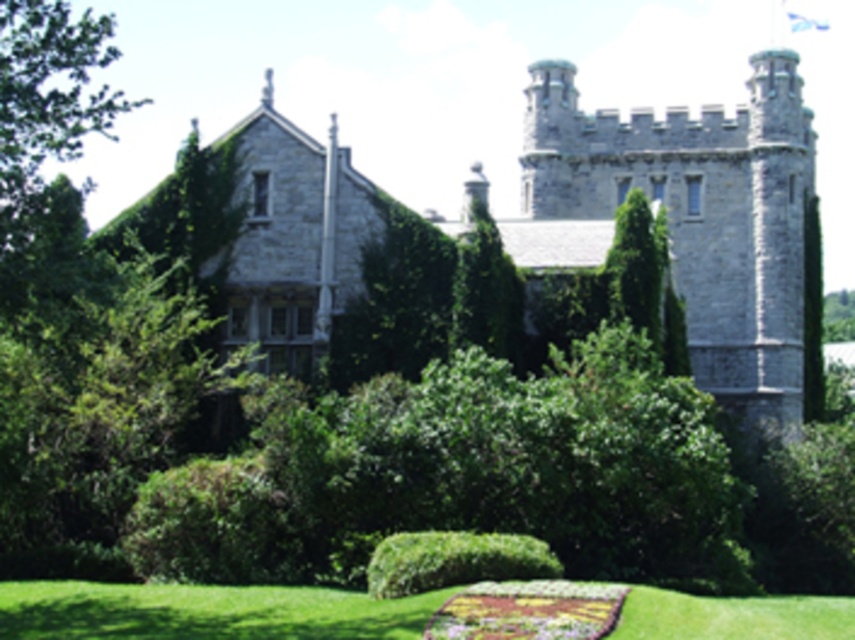
Who is shorter, green grass at lower center or multicolored fabric flower at lower center?

With less height is multicolored fabric flower at lower center.

Is green grass at lower center bigger than multicolored fabric flower at lower center?

Yes.

At what (x,y) coordinates should I click in order to perform the action: click on green grass at lower center. Please return your answer as a coordinate pair (x, y). Image resolution: width=855 pixels, height=640 pixels. Looking at the image, I should click on [205, 611].

You are a GUI agent. You are given a task and a screenshot of the screen. Output one action in this format:
    pyautogui.click(x=<x>, y=<y>)
    Task: Click on the green grass at lower center
    
    Given the screenshot: What is the action you would take?
    click(205, 611)

Between point (637, 140) and point (663, 611), which one is positioned in front?

Point (663, 611) is more forward.

Identify the location of stone castle at center. The height and width of the screenshot is (640, 855). point(687,216).

Which is in front, point (795, 122) or point (24, 588)?

Positioned in front is point (24, 588).

At what (x,y) coordinates should I click in order to perform the action: click on stone castle at center. Please return your answer as a coordinate pair (x, y). This screenshot has height=640, width=855. Looking at the image, I should click on (687, 216).

Is stone castle at center further to camera compared to multicolored fabric flower at lower center?

Yes, stone castle at center is further from the viewer.

Between stone castle at center and multicolored fabric flower at lower center, which one appears on the left side from the viewer's perspective?

multicolored fabric flower at lower center

Is point (276, 234) farther from viewer compared to point (612, 611)?

That is True.

Where is `stone castle at center`? The image size is (855, 640). stone castle at center is located at coordinates (687, 216).